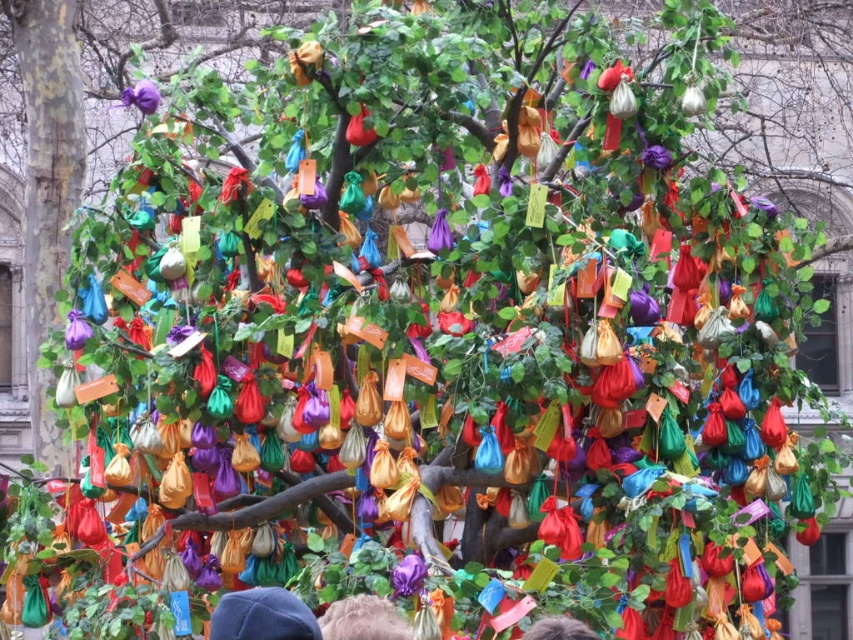
Question: Is blue fabric cap at center in front of gray hair at center?

Choices:
 (A) yes
 (B) no

Answer: (A)

Question: Is fuzzy brown hair at center bigger than gray hair at center?

Choices:
 (A) no
 (B) yes

Answer: (B)

Question: Which of the following is the farthest from the observer?

Choices:
 (A) fuzzy brown hair at center
 (B) gray hair at center

Answer: (B)

Question: Which of the following is the farthest from the observer?

Choices:
 (A) (544, 620)
 (B) (374, 596)
 (C) (259, 630)

Answer: (B)

Question: Which object is the farthest from the blue fabric cap at center?

Choices:
 (A) gray hair at center
 (B) fuzzy brown hair at center

Answer: (A)

Question: Can you confirm if blue fabric cap at center is positioned to the left of fuzzy brown hair at center?

Choices:
 (A) no
 (B) yes

Answer: (B)